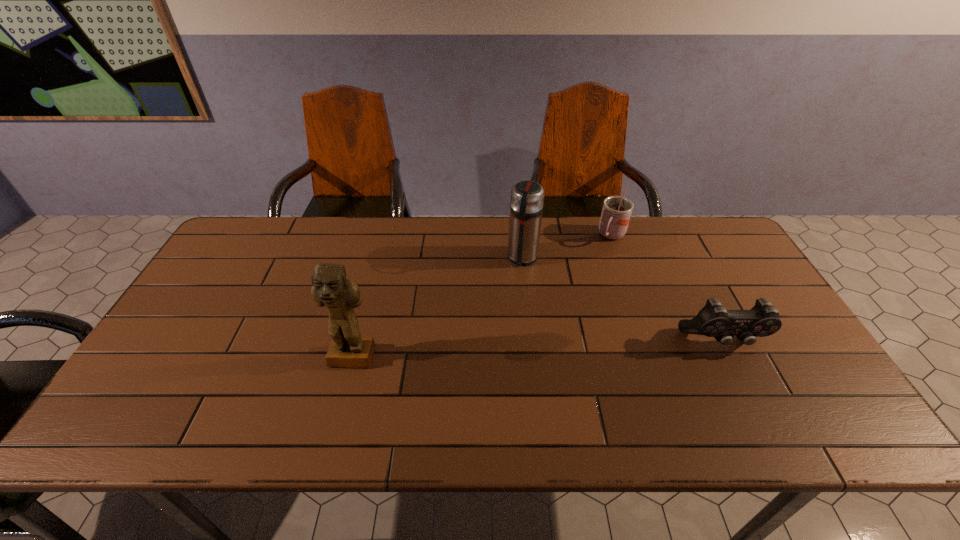
The width and height of the screenshot is (960, 540). I want to click on vacant region at the right edge of the desktop, so click(x=716, y=273).

In order to click on free space at the far right corner of the desktop in this screenshot , I will do `click(685, 248)`.

Find the location of a particular element. free spot between the cup and the second tallest object is located at coordinates (567, 247).

This screenshot has width=960, height=540. I want to click on free spot between the third object from right to left and the cup, so click(567, 247).

The width and height of the screenshot is (960, 540). Find the location of `vacant area that lies between the rightmost object and the cup`. vacant area that lies between the rightmost object and the cup is located at coordinates (667, 288).

This screenshot has width=960, height=540. I want to click on unoccupied position between the leftmost object and the rightmost object, so click(x=538, y=350).

The width and height of the screenshot is (960, 540). I want to click on empty space between the figurine and the thermos bottle, so click(438, 308).

This screenshot has width=960, height=540. I want to click on free area in between the rightmost object and the tallest object, so click(538, 350).

The image size is (960, 540). I want to click on vacant point located between the cup and the rightmost object, so click(667, 288).

Locate an element on the screen. The image size is (960, 540). free point between the cup and the figurine is located at coordinates (482, 298).